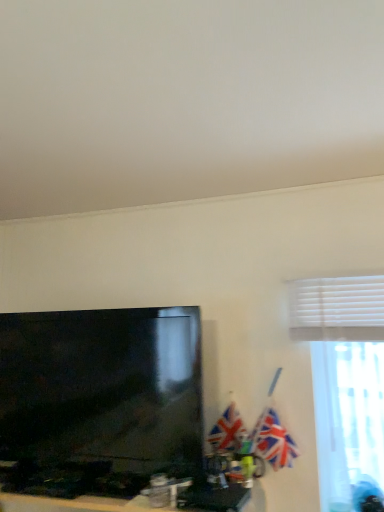
Question: Which direction should I rotate to look at textured fabric flag at center, the 2th flag viewed from the right?

Choices:
 (A) right
 (B) left

Answer: (A)

Question: From the image's perspective, is white blinds at upper right over matte black tv at left?

Choices:
 (A) no
 (B) yes

Answer: (B)

Question: From the image's perspective, would you say white blinds at upper right is shown under matte black tv at left?

Choices:
 (A) yes
 (B) no

Answer: (B)

Question: Is white blinds at upper right taller than matte black tv at left?

Choices:
 (A) no
 (B) yes

Answer: (B)

Question: Is white blinds at upper right further to the viewer compared to matte black tv at left?

Choices:
 (A) no
 (B) yes

Answer: (B)

Question: From a real-world perspective, is white blinds at upper right located beneath matte black tv at left?

Choices:
 (A) yes
 (B) no

Answer: (B)

Question: Is matte black tv at left located within white blinds at upper right?

Choices:
 (A) no
 (B) yes

Answer: (A)

Question: Is blue glossy flag pole at upper right further to camera compared to matte black tv at lower left?

Choices:
 (A) no
 (B) yes

Answer: (B)

Question: Does blue glossy flag pole at upper right have a lesser height compared to matte black tv at lower left?

Choices:
 (A) yes
 (B) no

Answer: (B)

Question: Could you tell me if blue glossy flag pole at upper right is turned towards matte black tv at lower left?

Choices:
 (A) yes
 (B) no

Answer: (B)

Question: Can you confirm if blue glossy flag pole at upper right is thinner than matte black tv at lower left?

Choices:
 (A) yes
 (B) no

Answer: (A)

Question: Is blue glossy flag pole at upper right surrounding matte black tv at lower left?

Choices:
 (A) no
 (B) yes

Answer: (A)

Question: Can you confirm if blue glossy flag pole at upper right is wider than matte black tv at lower left?

Choices:
 (A) yes
 (B) no

Answer: (B)

Question: Is textured fabric flag at center, the 2th flag viewed from the right, far away from union jack flag at right, marked as the first flag in a right-to-left arrangement?

Choices:
 (A) yes
 (B) no

Answer: (B)